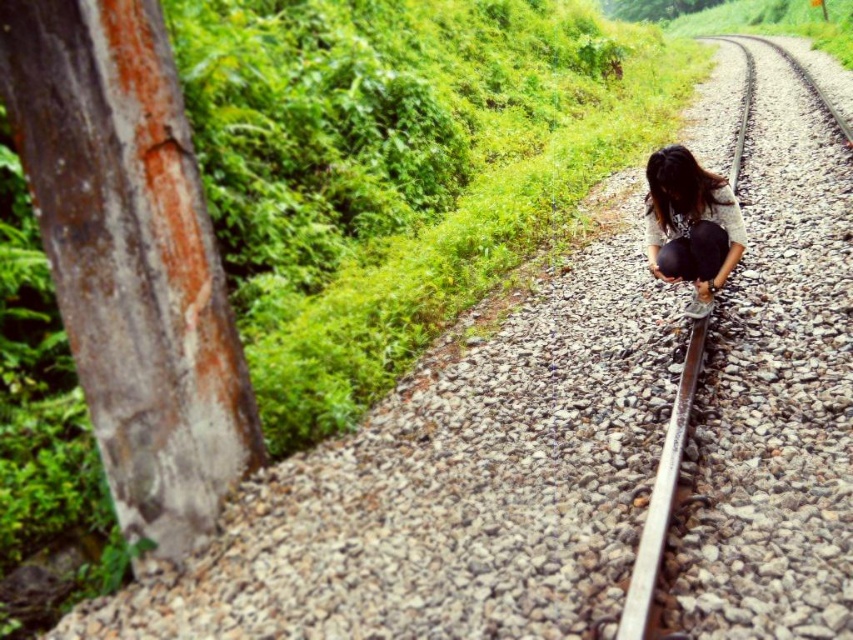
You are a photographer trying to capture a detailed shot of two specific points on the railway track in the image. The points are labeled as point 1 at coordinates point (646, 566) and point 2 at coordinates point (653, 536). Since you want to focus on the one that is nearer to your camera, which point should you choose?

Point (646, 566) is closer to the camera than point (653, 536), so you should choose point (646, 566) for your detailed shot.